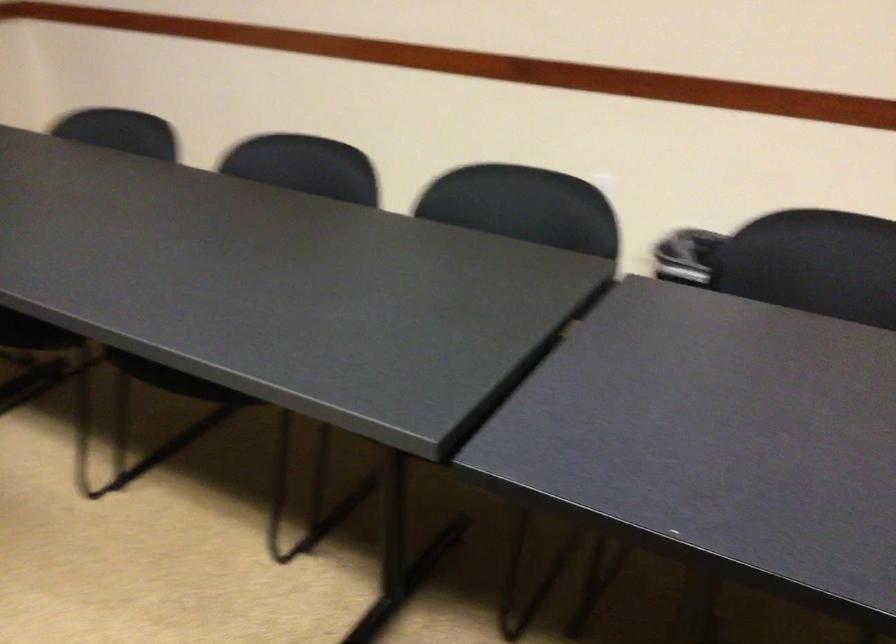
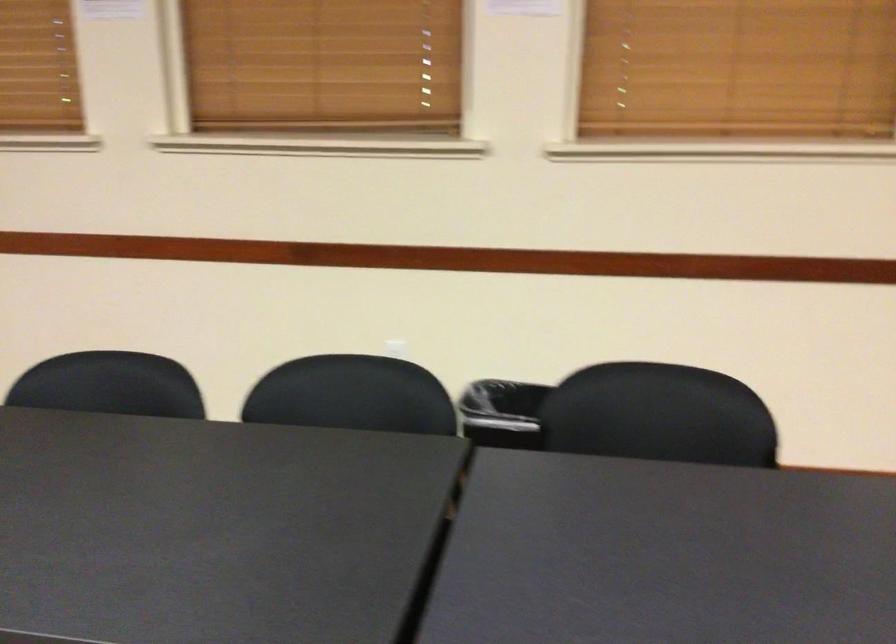
Question: How did the camera likely rotate?

Choices:
 (A) Left
 (B) Right
 (C) Up
 (D) Down

Answer: (B)